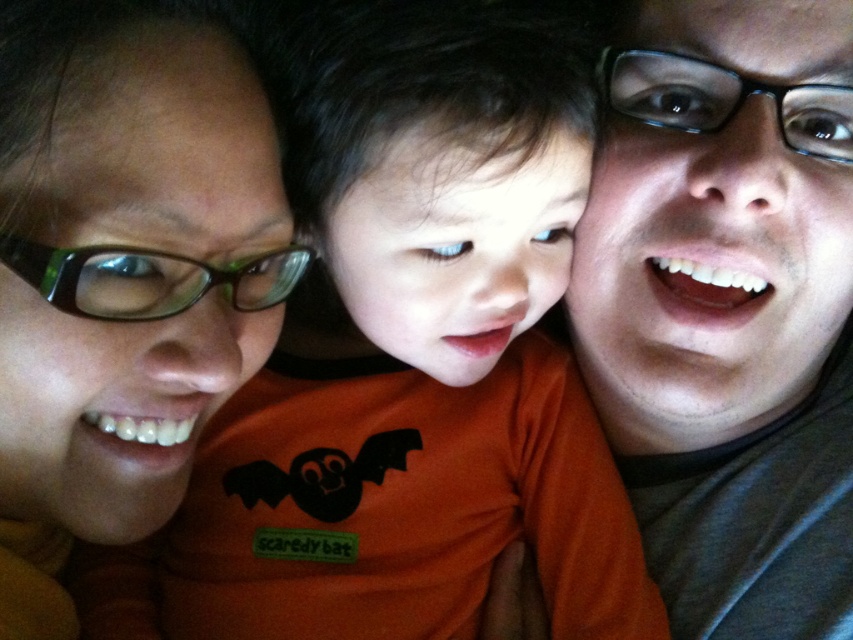
You are a photographer adjusting the camera settings for a family photo. The scene includes an orange matte shirt at center and a matte orange shirt at center. Are the two orange matte shirts at center positioned close enough to ensure both are in focus simultaneously?

The orange matte shirt at center is 5.94 inches from matte orange shirt at center. Since the distance between them is minimal, both shirts can be in focus simultaneously if the camera is set to an appropriate aperture for that depth of field.